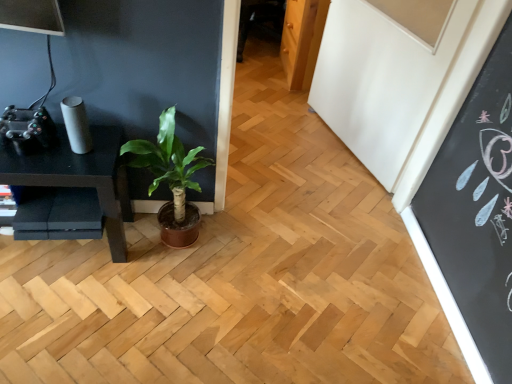
The image size is (512, 384). I want to click on black matte table at left, so click(x=80, y=177).

Based on the photo, measure the distance between black matte table at left and camera.

They are 4.36 feet apart.

This screenshot has width=512, height=384. What do you see at coordinates (80, 177) in the screenshot?
I see `black matte table at left` at bounding box center [80, 177].

The height and width of the screenshot is (384, 512). Describe the element at coordinates (170, 179) in the screenshot. I see `green leafy plant at center` at that location.

Locate an element on the screen. green leafy plant at center is located at coordinates (170, 179).

This screenshot has width=512, height=384. I want to click on black matte table at left, so click(x=80, y=177).

Which is more to the left, green leafy plant at center or black matte table at left?

Positioned to the left is black matte table at left.

Considering the relative positions of green leafy plant at center and black matte table at left in the image provided, is green leafy plant at center behind black matte table at left?

No, it is in front of black matte table at left.

Is point (187, 226) less distant than point (109, 133)?

That is False.

From the image's perspective, is green leafy plant at center below black matte table at left?

Incorrect, from the image's perspective, green leafy plant at center is higher than black matte table at left.

From a real-world perspective, is green leafy plant at center below black matte table at left?

No, from a real-world perspective, green leafy plant at center is not below black matte table at left.

Considering the sizes of objects green leafy plant at center and black matte table at left in the image provided, who is thinner, green leafy plant at center or black matte table at left?

With smaller width is black matte table at left.

Considering the relative sizes of green leafy plant at center and black matte table at left in the image provided, is green leafy plant at center taller than black matte table at left?

Indeed, green leafy plant at center has a greater height compared to black matte table at left.

Can you confirm if green leafy plant at center is smaller than black matte table at left?

Yes, green leafy plant at center is smaller than black matte table at left.

Is black matte table at left surrounded by green leafy plant at center?

No.

Is green leafy plant at center not close to black matte table at left?

No, green leafy plant at center is not far from black matte table at left.

Is green leafy plant at center oriented towards black matte table at left?

No, green leafy plant at center is not turned towards black matte table at left.

Can you tell me how much green leafy plant at center and black matte table at left differ in facing direction?

0.0874 degrees separate the facing orientations of green leafy plant at center and black matte table at left.

I want to click on houseplant on the right of black matte table at left, so click(x=170, y=179).

Considering the positions of objects black matte table at left and green leafy plant at center in the image provided, who is more to the right, black matte table at left or green leafy plant at center?

From the viewer's perspective, green leafy plant at center appears more on the right side.

Which is in front, black matte table at left or green leafy plant at center?

green leafy plant at center is in front.

Considering the points (64, 150) and (199, 150), which point is in front, point (64, 150) or point (199, 150)?

Positioned in front is point (64, 150).

From the image's perspective, is black matte table at left over green leafy plant at center?

No, from the image's perspective, black matte table at left is not above green leafy plant at center.

From a real-world perspective, which is physically above, black matte table at left or green leafy plant at center?

In real-world perspective, green leafy plant at center is above.

In terms of width, does black matte table at left look wider or thinner when compared to green leafy plant at center?

black matte table at left is thinner than green leafy plant at center.

In terms of height, does black matte table at left look taller or shorter compared to green leafy plant at center?

black matte table at left is shorter than green leafy plant at center.

Is black matte table at left smaller than green leafy plant at center?

Actually, black matte table at left might be larger than green leafy plant at center.

Is black matte table at left completely or partially outside of green leafy plant at center?

That's correct, black matte table at left is outside of green leafy plant at center.

Does black matte table at left touch green leafy plant at center?

black matte table at left and green leafy plant at center are not in contact.

Is black matte table at left positioned with its back to green leafy plant at center?

No.

Identify the location of table behind the green leafy plant at center. Image resolution: width=512 pixels, height=384 pixels. (80, 177).

Locate an element on the screen. The image size is (512, 384). houseplant lying in front of the black matte table at left is located at coordinates (170, 179).

You are a GUI agent. You are given a task and a screenshot of the screen. Output one action in this format:
    pyautogui.click(x=<x>, y=<y>)
    Task: Click on the table on the left of green leafy plant at center
    
    Given the screenshot: What is the action you would take?
    pyautogui.click(x=80, y=177)